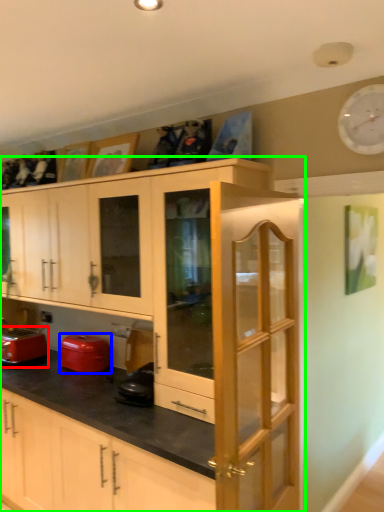
Question: Which object is positioned closest to home appliance (highlighted by a red box)? Select from appliance (highlighted by a blue box) and cabinetry (highlighted by a green box).

Choices:
 (A) appliance
 (B) cabinetry

Answer: (A)